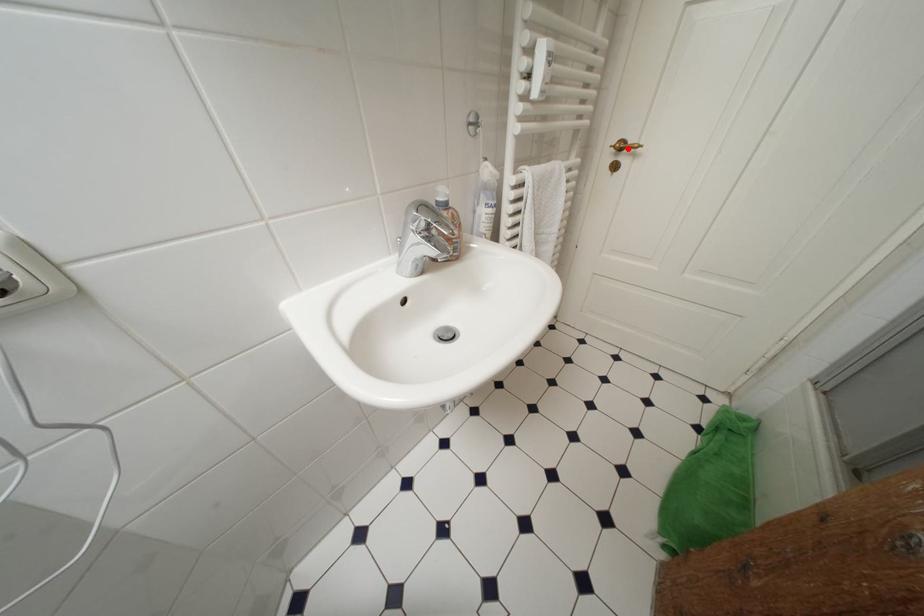
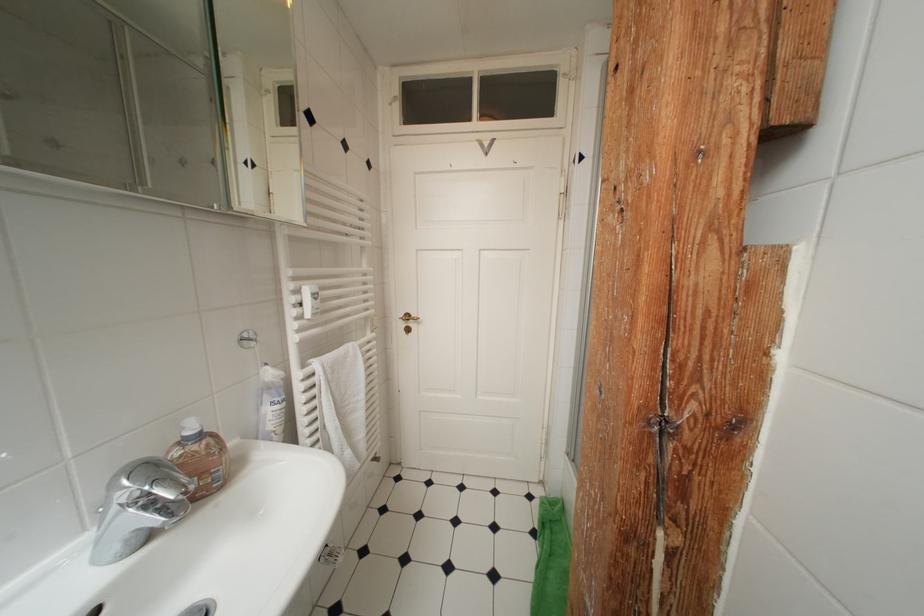
Find the pixel in the second image that matches the highlighted location in the first image.

(415, 320)